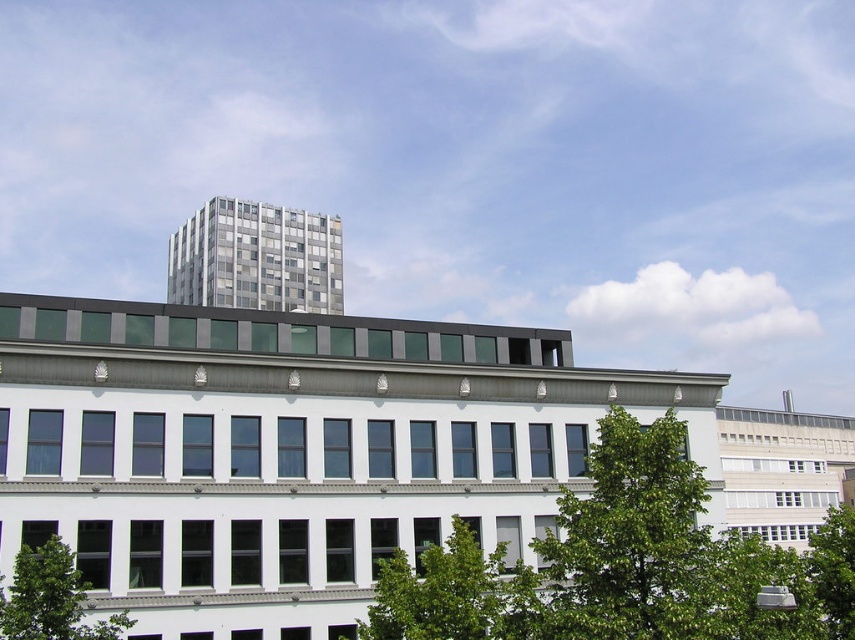
How much distance is there between green leafy tree at center and green leafy tree at lower right?

A distance of 6.71 meters exists between green leafy tree at center and green leafy tree at lower right.

Is point (656, 625) closer to viewer compared to point (839, 616)?

Yes.

Which is in front, point (562, 548) or point (828, 541)?

Positioned in front is point (562, 548).

At what (x,y) coordinates should I click in order to perform the action: click on green leafy tree at center. Please return your answer as a coordinate pair (x, y). This screenshot has height=640, width=855. Looking at the image, I should click on tap(632, 541).

Does green leafy tree at lower left appear on the right side of green leafy tree at lower right?

In fact, green leafy tree at lower left is to the left of green leafy tree at lower right.

You are a GUI agent. You are given a task and a screenshot of the screen. Output one action in this format:
    pyautogui.click(x=<x>, y=<y>)
    Task: Click on the green leafy tree at lower left
    This screenshot has width=855, height=640.
    Given the screenshot: What is the action you would take?
    pyautogui.click(x=50, y=598)

Is point (15, 566) positioned in front of point (842, 628)?

Yes, point (15, 566) is in front of point (842, 628).

You are a GUI agent. You are given a task and a screenshot of the screen. Output one action in this format:
    pyautogui.click(x=<x>, y=<y>)
    Task: Click on the green leafy tree at lower left
    
    Given the screenshot: What is the action you would take?
    pyautogui.click(x=50, y=598)

This screenshot has width=855, height=640. Identify the location of green leafy tree at center. (632, 541).

Between green leafy tree at center and green leafy tree at lower left, which one has more height?

With more height is green leafy tree at center.

Find the location of a particular element. The image size is (855, 640). green leafy tree at center is located at coordinates (632, 541).